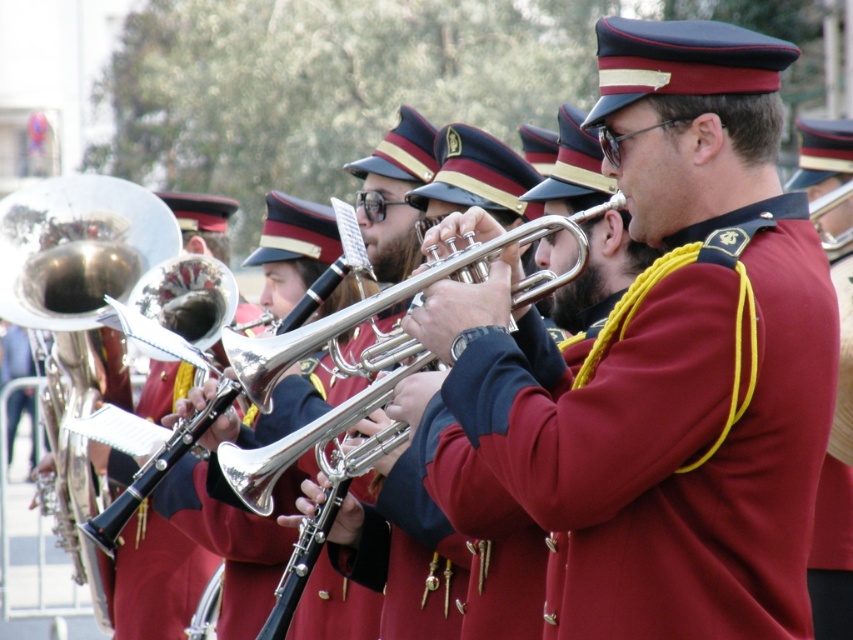
Does maroon fabric uniform at center appear on the left side of shiny brass trumpet at center?

In fact, maroon fabric uniform at center is to the right of shiny brass trumpet at center.

Between maroon fabric uniform at center and shiny brass trumpet at center, which one has more height?

shiny brass trumpet at center is taller.

Image resolution: width=853 pixels, height=640 pixels. In order to click on maroon fabric uniform at center in this screenshot , I will do `click(674, 435)`.

Is maroon fabric uniform at center shorter than silver shiny trumpet at center?

Incorrect, maroon fabric uniform at center's height does not fall short of silver shiny trumpet at center's.

Is maroon fabric uniform at center thinner than silver shiny trumpet at center?

Correct, maroon fabric uniform at center's width is less than silver shiny trumpet at center's.

What do you see at coordinates (674, 435) in the screenshot?
I see `maroon fabric uniform at center` at bounding box center [674, 435].

At what (x,y) coordinates should I click in order to perform the action: click on maroon fabric uniform at center. Please return your answer as a coordinate pair (x, y). Image resolution: width=853 pixels, height=640 pixels. Looking at the image, I should click on (674, 435).

Which is more to the left, shiny brass trumpet at center or silver shiny trumpet at center?

Positioned to the left is shiny brass trumpet at center.

Does shiny brass trumpet at center have a lesser width compared to silver shiny trumpet at center?

Yes.

At what (x,y) coordinates should I click in order to perform the action: click on shiny brass trumpet at center. Please return your answer as a coordinate pair (x, y). The image size is (853, 640). Looking at the image, I should click on (79, 308).